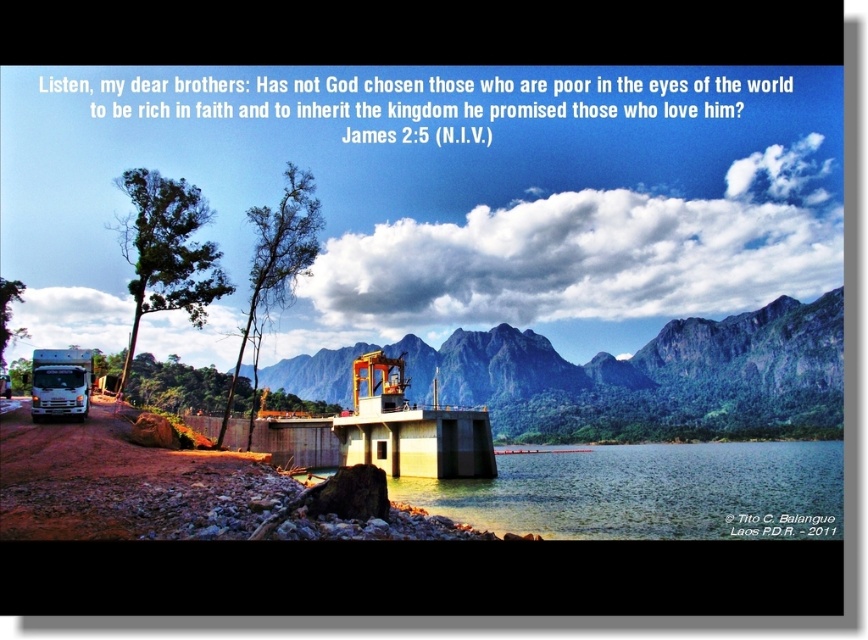
Question: Can you confirm if green rock mountain at center is positioned above clear water at lower center?

Choices:
 (A) yes
 (B) no

Answer: (A)

Question: Among these objects, which one is nearest to the camera?

Choices:
 (A) green rock mountain at center
 (B) clear water at lower center
 (C) white glossy truck at lower left

Answer: (B)

Question: Among these objects, which one is farthest from the camera?

Choices:
 (A) clear water at lower center
 (B) green rock mountain at center

Answer: (B)

Question: Is clear water at lower center thinner than white glossy truck at lower left?

Choices:
 (A) no
 (B) yes

Answer: (A)

Question: Is clear water at lower center wider than white glossy truck at lower left?

Choices:
 (A) yes
 (B) no

Answer: (A)

Question: Which point is farther to the camera?

Choices:
 (A) (625, 492)
 (B) (35, 358)
 (C) (502, 378)

Answer: (C)